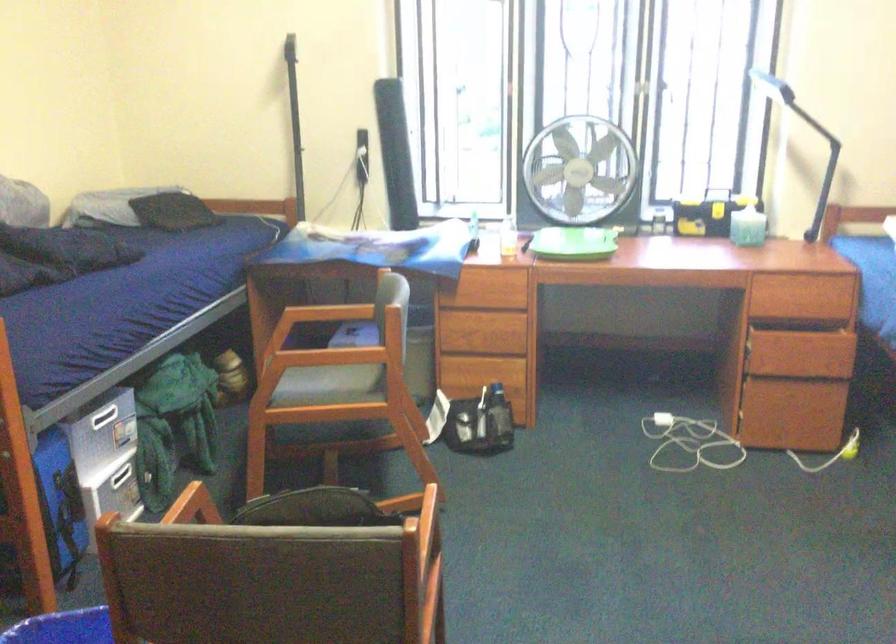
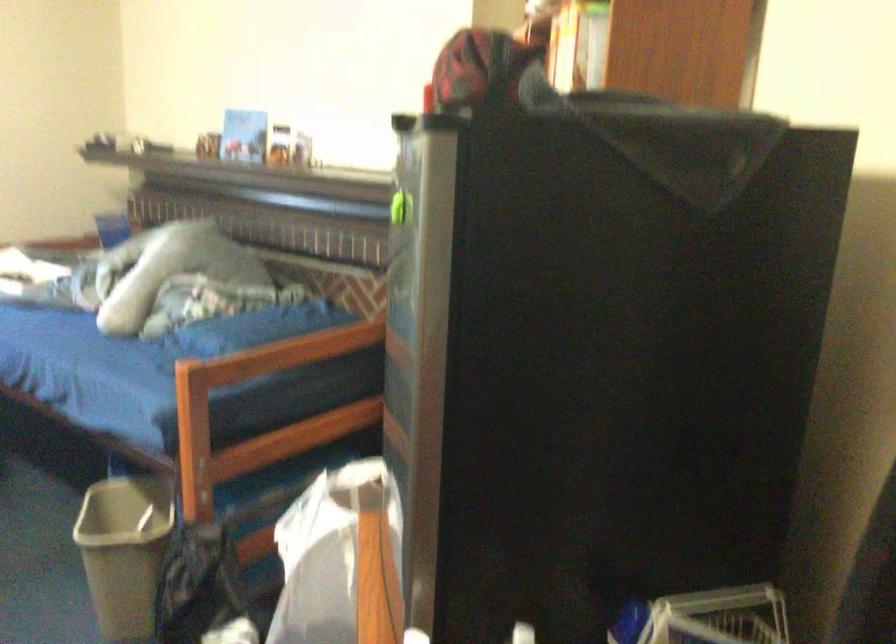
Question: The camera is either moving clockwise (left) or counter-clockwise (right) around the object. The first image is from the beginning of the video and the second image is from the end. Is the camera moving left or right when shooting the video?

Choices:
 (A) Left
 (B) Right

Answer: (A)